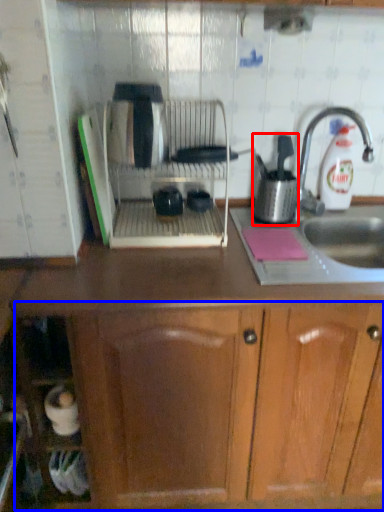
Question: Among these objects, which one is farthest to the camera, kitchen appliance (highlighted by a red box) or drawer (highlighted by a blue box)?

Choices:
 (A) kitchen appliance
 (B) drawer

Answer: (A)